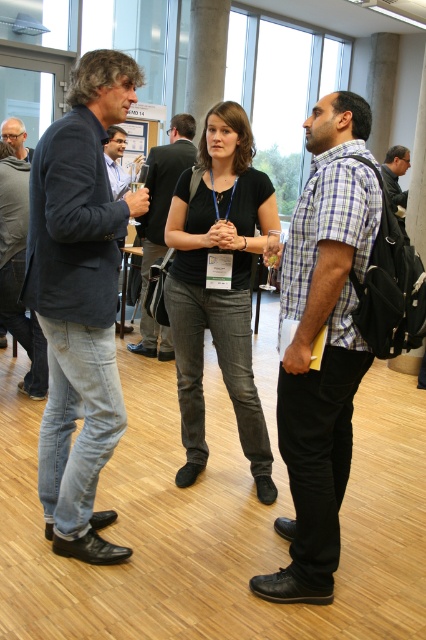
Question: Is denim jeans at left bigger than dark blue denim jeans at left?

Choices:
 (A) yes
 (B) no

Answer: (A)

Question: Which of these objects is positioned closest to the black denim jeans at center?

Choices:
 (A) dark blue shirt at center
 (B) dark blue denim jeans at left

Answer: (B)

Question: Which object appears farthest from the camera in this image?

Choices:
 (A) dark blue shirt at center
 (B) plaid cotton shirt at center
 (C) black denim jeans at center

Answer: (A)

Question: Does plaid cotton shirt at center have a larger size compared to black denim jeans at center?

Choices:
 (A) no
 (B) yes

Answer: (B)

Question: Which object is the closest to the dark blue denim jeans at left?

Choices:
 (A) matte black glasses at upper left
 (B) plaid cotton shirt at center
 (C) matte black jacket at center

Answer: (A)

Question: Is denim jeans at left further to camera compared to black denim jeans at center?

Choices:
 (A) yes
 (B) no

Answer: (B)